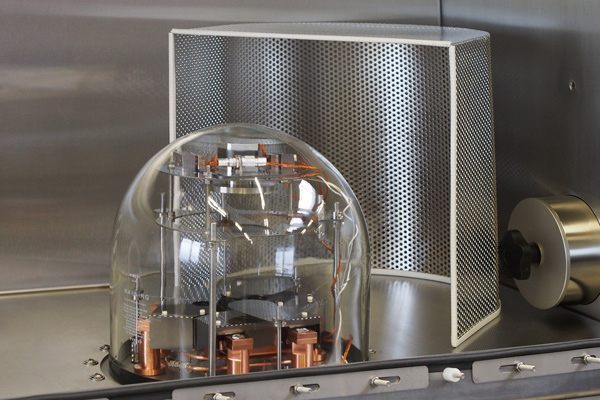
Where is `small hole in wall`? Image resolution: width=600 pixels, height=400 pixels. small hole in wall is located at coordinates pyautogui.click(x=572, y=87).